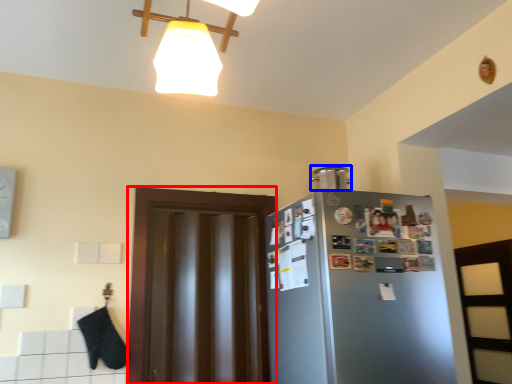
Question: Among these objects, which one is farthest to the camera, glass door (highlighted by a red box) or appliance (highlighted by a blue box)?

Choices:
 (A) glass door
 (B) appliance

Answer: (B)